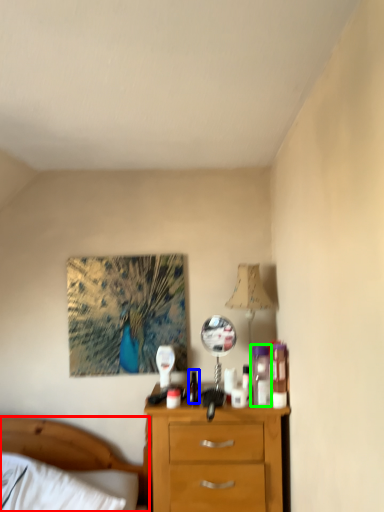
Question: Which object is the farthest from bed (highlighted by a red box)? Choose among these: bottle (highlighted by a blue box) or toiletry (highlighted by a green box).

Choices:
 (A) bottle
 (B) toiletry

Answer: (B)